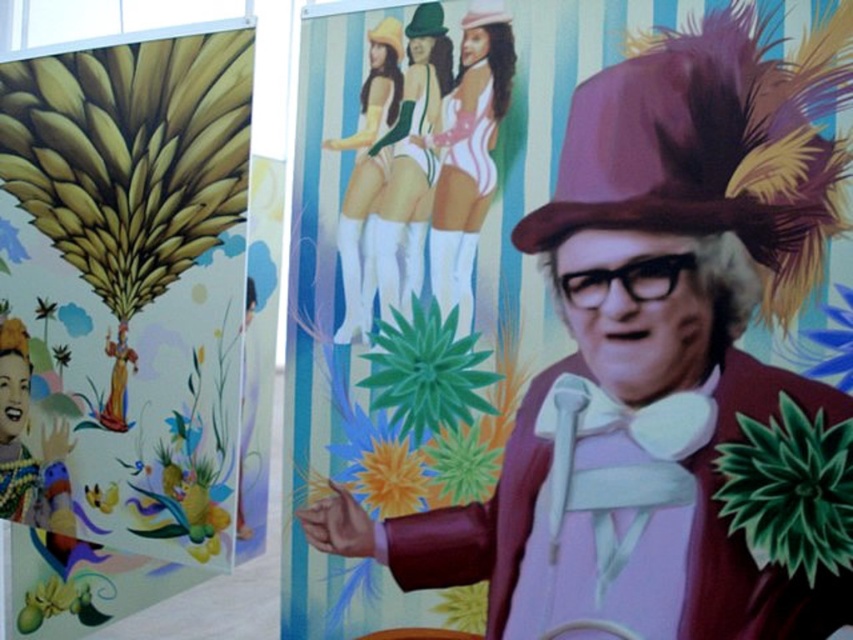
You are standing in front of the image and want to know which of the two points, point (683, 99) or point (460, 108), is closer to you. Based on the scene description, can you determine which point is nearer?

Point (683, 99) is in front of point (460, 108), so it is closer to you.

You are a photographer trying to capture a closeup of the brown feathered hat at upper right and the smooth green dress at center. Given that your camera can focus on objects within a 15 inch range, will you need to adjust your focus to capture both clearly?

Answer: The brown feathered hat at upper right is 16.71 inches away from the smooth green dress at center, which is beyond the camera focus range of 15 inches. Therefore, you will need to adjust your focus to capture both clearly.

You are a fashion designer observing the image. You need to determine the spatial relationship between the brown feathered hat at upper right and the smooth green dress at center. Which object is positioned to the right of the other?

The brown feathered hat at upper right is positioned to the right of smooth green dress at center.